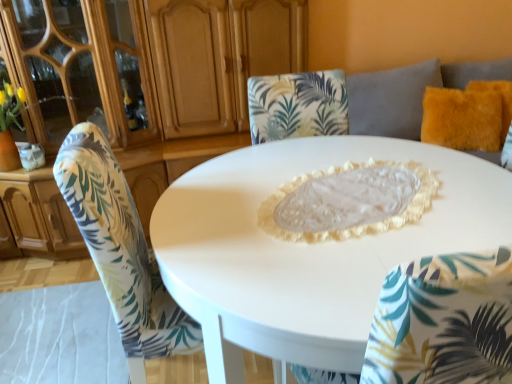
Question: From the image's perspective, is printed fabric chair at center located beneath matte wood dresser at upper left?

Choices:
 (A) yes
 (B) no

Answer: (A)

Question: Is printed fabric chair at center smaller than matte wood dresser at upper left?

Choices:
 (A) yes
 (B) no

Answer: (A)

Question: Is matte wood dresser at upper left surrounded by printed fabric chair at center?

Choices:
 (A) yes
 (B) no

Answer: (B)

Question: From a real-world perspective, is printed fabric chair at center physically below matte wood dresser at upper left?

Choices:
 (A) no
 (B) yes

Answer: (B)

Question: Is printed fabric chair at center not inside matte wood dresser at upper left?

Choices:
 (A) no
 (B) yes

Answer: (B)

Question: Is point (77, 155) positioned closer to the camera than point (452, 104)?

Choices:
 (A) farther
 (B) closer

Answer: (B)

Question: From their relative heights in the image, would you say printed fabric chair at center is taller or shorter than fuzzy orange pillow at upper right?

Choices:
 (A) short
 (B) tall

Answer: (B)

Question: From a real-world perspective, is printed fabric chair at center positioned above or below fuzzy orange pillow at upper right?

Choices:
 (A) above
 (B) below

Answer: (B)

Question: In the image, is printed fabric chair at center on the left side or the right side of fuzzy orange pillow at upper right?

Choices:
 (A) left
 (B) right

Answer: (A)

Question: Relative to white glossy table at center, is printed fabric chair at center in front or behind?

Choices:
 (A) front
 (B) behind

Answer: (B)

Question: Considering the positions of printed fabric chair at center and white glossy table at center in the image, is printed fabric chair at center wider or thinner than white glossy table at center?

Choices:
 (A) wide
 (B) thin

Answer: (B)

Question: Looking at the image, does printed fabric chair at center seem bigger or smaller compared to white glossy table at center?

Choices:
 (A) small
 (B) big

Answer: (A)

Question: In terms of height, does printed fabric chair at center look taller or shorter compared to white glossy table at center?

Choices:
 (A) tall
 (B) short

Answer: (A)

Question: Relative to matte wood dresser at upper left, is fuzzy orange pillow at upper right in front or behind?

Choices:
 (A) behind
 (B) front

Answer: (A)

Question: From their relative heights in the image, would you say fuzzy orange pillow at upper right is taller or shorter than matte wood dresser at upper left?

Choices:
 (A) tall
 (B) short

Answer: (B)